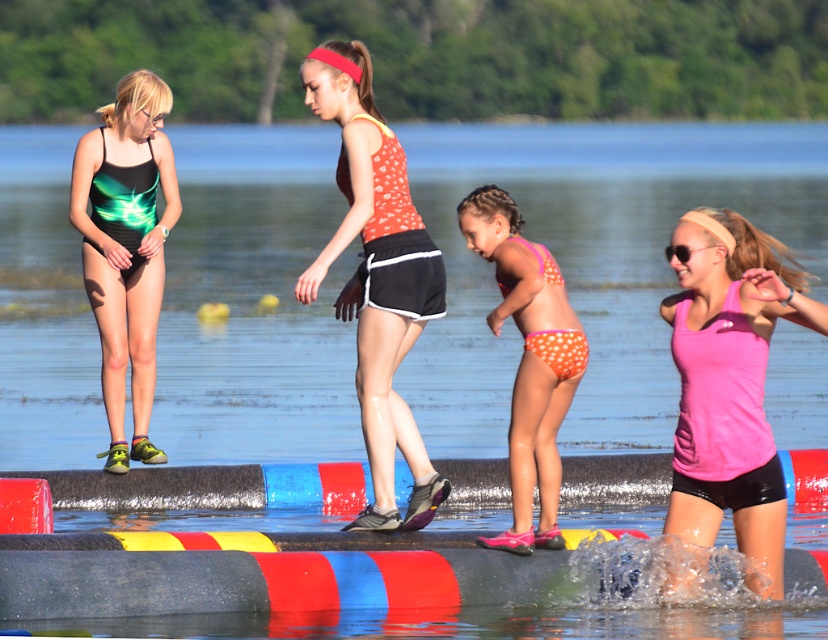
Question: Which point is farther from the camera taking this photo?

Choices:
 (A) (521, 532)
 (B) (687, 305)
 (C) (432, 509)

Answer: (C)

Question: Does orange dotted tank top at center have a greater width compared to orange polka dot bikini at center?

Choices:
 (A) no
 (B) yes

Answer: (B)

Question: Among these objects, which one is nearest to the camera?

Choices:
 (A) orange dotted tank top at center
 (B) pink matte tank top at center

Answer: (B)

Question: Can you confirm if pink matte tank top at center is smaller than green iridescent swimsuit at left?

Choices:
 (A) yes
 (B) no

Answer: (A)

Question: Is pink matte tank top at center further to the viewer compared to green iridescent swimsuit at left?

Choices:
 (A) no
 (B) yes

Answer: (A)

Question: Which point is closer to the camera?

Choices:
 (A) (520, 545)
 (B) (408, 212)
 (C) (747, 445)

Answer: (C)